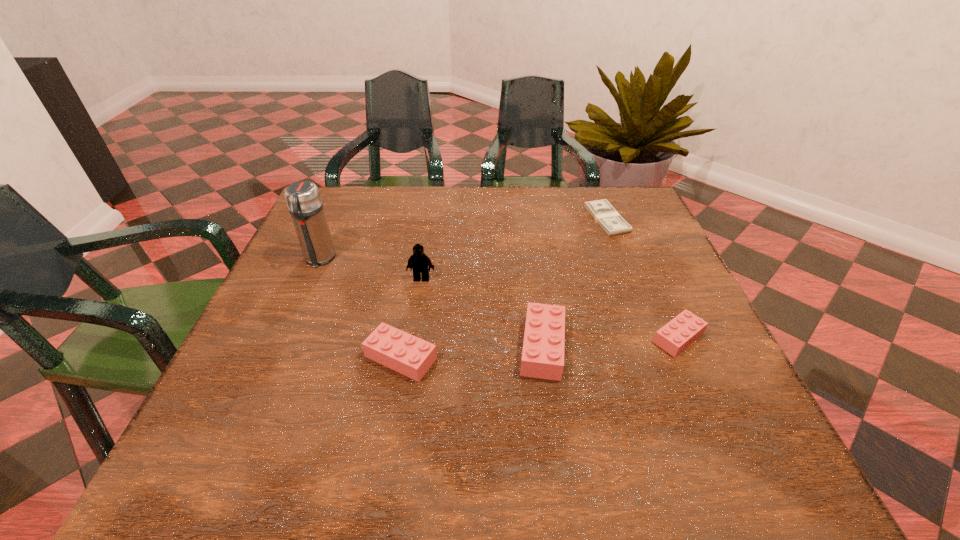
What are the coordinates of `dollar at the right edge` in the screenshot? It's located at (602, 211).

At what (x,y) coordinates should I click in order to perform the action: click on object at the far right corner. Please return your answer as a coordinate pair (x, y). The image size is (960, 540). Looking at the image, I should click on (602, 211).

At what (x,y) coordinates should I click in order to perform the action: click on free point at the far edge. Please return your answer as a coordinate pair (x, y). Looking at the image, I should click on (535, 232).

Find the location of a particular element. This screenshot has height=540, width=960. blank area at the near edge is located at coordinates (620, 389).

Find the location of a particular element. The width and height of the screenshot is (960, 540). free space at the left edge of the desktop is located at coordinates (301, 336).

This screenshot has height=540, width=960. I want to click on free space at the right edge, so click(x=613, y=256).

In the image, there is a desktop. At what (x,y) coordinates should I click in order to perform the action: click on vacant region at the far left corner. Please return your answer as a coordinate pair (x, y). Image resolution: width=960 pixels, height=540 pixels. Looking at the image, I should click on (355, 188).

At what (x,y) coordinates should I click in order to perform the action: click on free region at the near left corner of the desktop. Please return your answer as a coordinate pair (x, y). Looking at the image, I should click on (228, 399).

In the image, there is a desktop. Where is `free space at the far right corner`? This screenshot has height=540, width=960. free space at the far right corner is located at coordinates (624, 198).

Where is `free area in between the leftmost object and the rightmost Lego`? This screenshot has width=960, height=540. free area in between the leftmost object and the rightmost Lego is located at coordinates click(x=499, y=298).